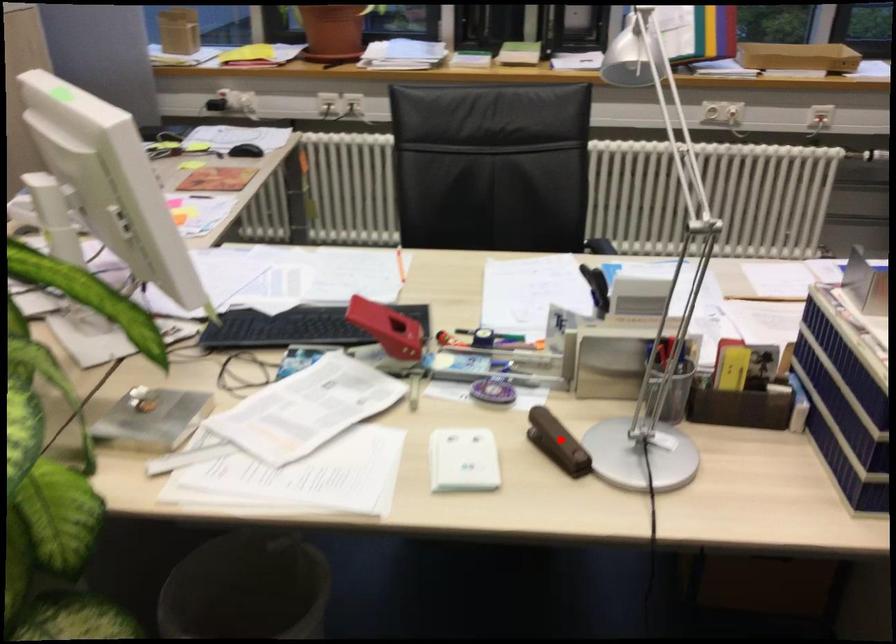
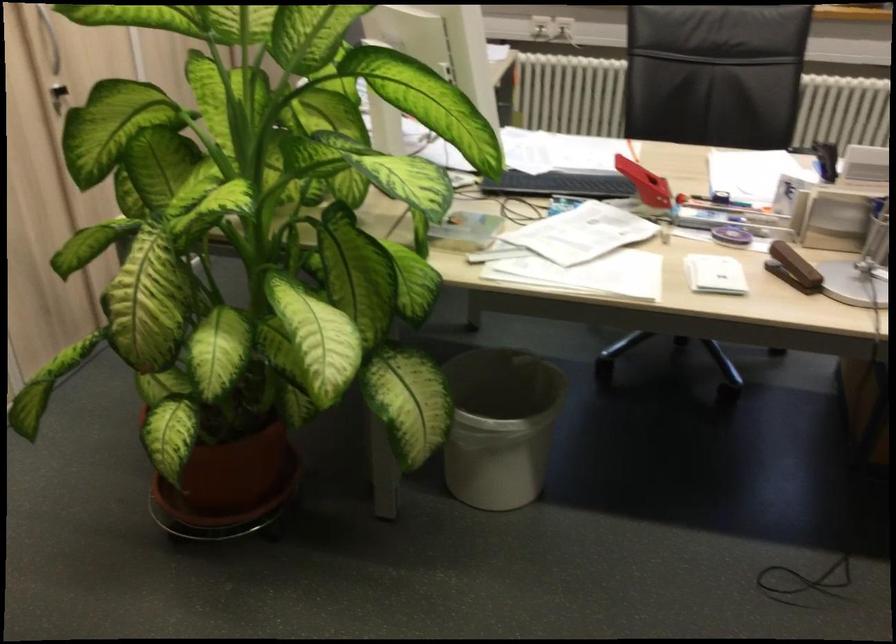
Question: A red point is marked in image1. In image2, is the corresponding 3D point closer to the camera or farther? Reply with the corresponding letter.

Choices:
 (A) The corresponding 3D point is closer.
 (B) The corresponding 3D point is farther.

Answer: (B)